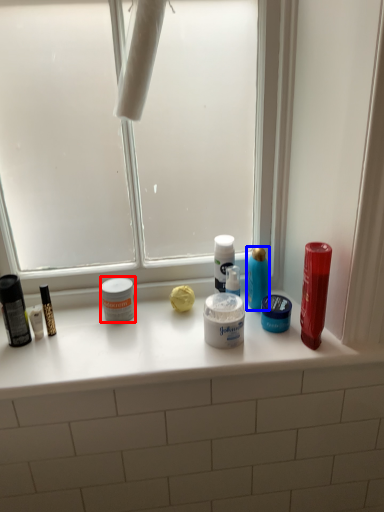
Question: Which point is closer to the camera, toiletry (highlighted by a red box) or cleaning product (highlighted by a blue box)?

Choices:
 (A) toiletry
 (B) cleaning product

Answer: (A)